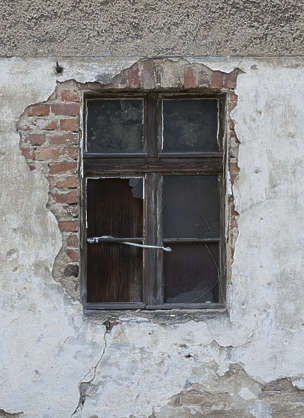
The height and width of the screenshot is (418, 304). Identify the location of brick wall. (63, 177), (232, 212), (158, 77).